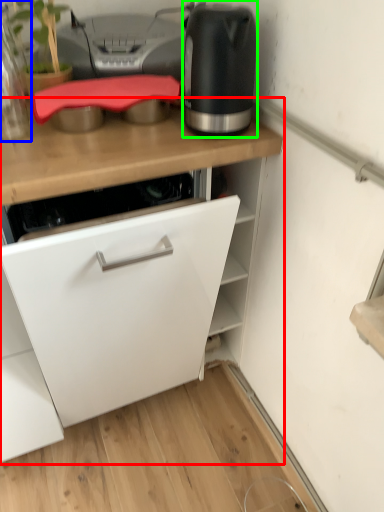
Question: Which is farther away from cabinetry (highlighted by a red box)? kitchen appliance (highlighted by a blue box) or home appliance (highlighted by a green box)?

Choices:
 (A) kitchen appliance
 (B) home appliance

Answer: (A)